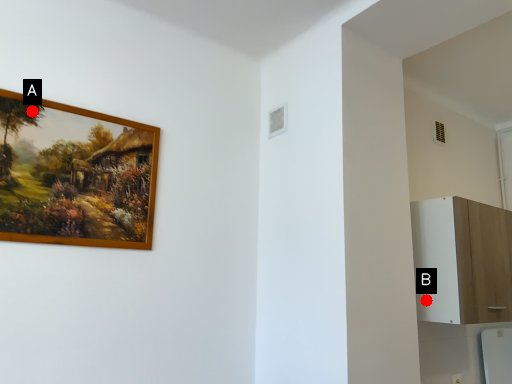
Question: Two points are circled on the image, labeled by A and B beside each circle. Which point is closer to the camera taking this photo?

Choices:
 (A) A is closer
 (B) B is closer

Answer: (A)